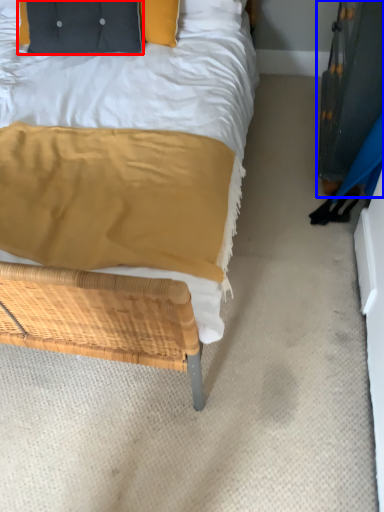
Question: Among these objects, which one is farthest to the camera, pillow (highlighted by a red box) or dresser (highlighted by a blue box)?

Choices:
 (A) pillow
 (B) dresser

Answer: (A)